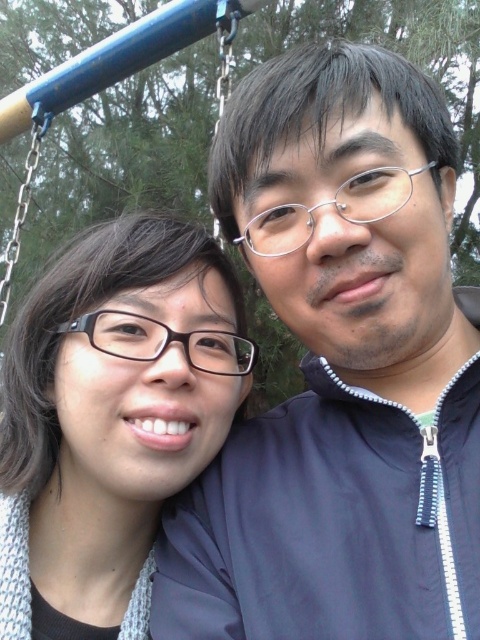
Question: Can you confirm if matte blue jacket at upper right is thinner than matte black glasses at left?

Choices:
 (A) no
 (B) yes

Answer: (A)

Question: Which object is farther from the camera taking this photo?

Choices:
 (A) matte black glasses at left
 (B) matte blue jacket at upper right

Answer: (A)

Question: Which point is farther to the camera?

Choices:
 (A) matte blue jacket at upper right
 (B) matte black glasses at left

Answer: (B)

Question: Does matte blue jacket at upper right come in front of matte black glasses at left?

Choices:
 (A) no
 (B) yes

Answer: (B)

Question: Which object appears farthest from the camera in this image?

Choices:
 (A) matte black glasses at left
 (B) matte blue jacket at upper right

Answer: (A)

Question: Does matte blue jacket at upper right appear on the right side of matte black glasses at left?

Choices:
 (A) no
 (B) yes

Answer: (B)